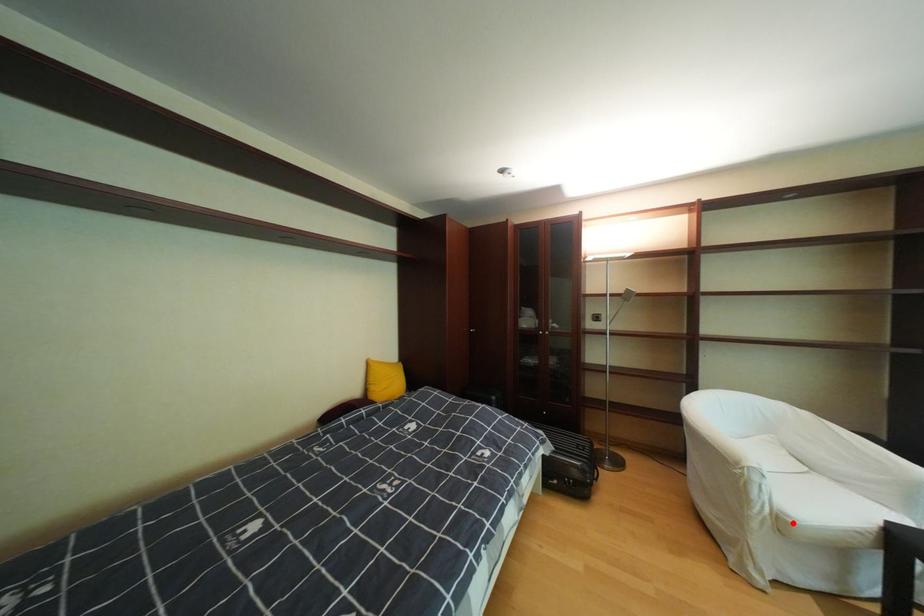
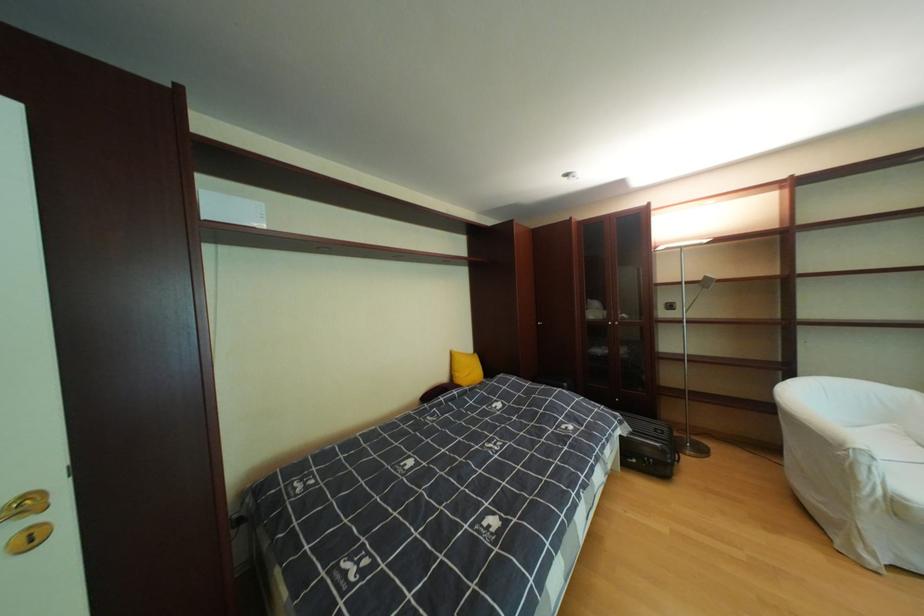
The point at the highlighted location is marked in the first image. Where is the corresponding point in the second image?

(908, 506)